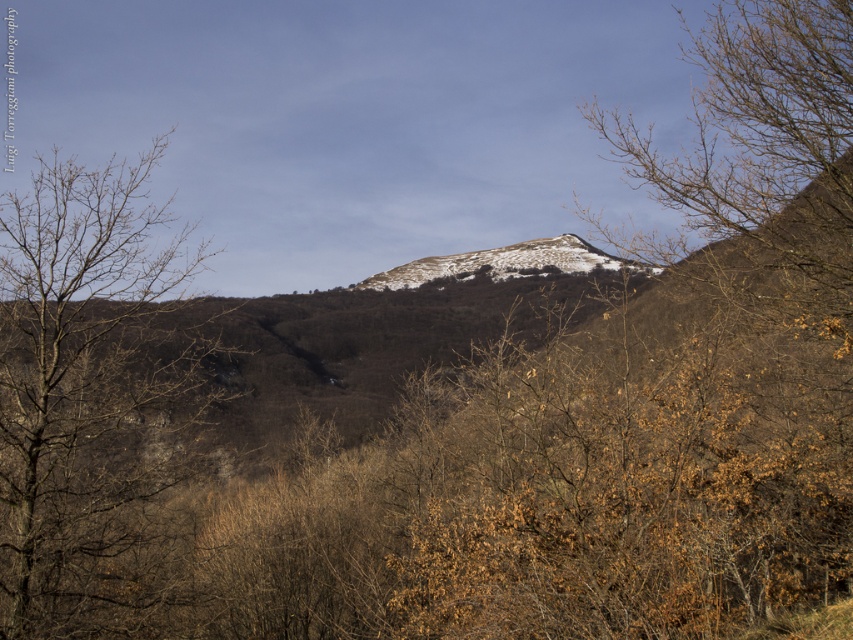
Can you confirm if bare branches at left is positioned above brown leafless branches at upper right?

Actually, bare branches at left is below brown leafless branches at upper right.

Consider the image. Which of these two, bare branches at left or brown leafless branches at upper right, stands shorter?

Standing shorter between the two is bare branches at left.

Is point (94, 477) in front of point (720, 225)?

Yes, it is in front of point (720, 225).

The image size is (853, 640). I want to click on bare branches at left, so click(88, 392).

Which is above, bare branches at left or white powdery snow at center?

bare branches at left

Locate an element on the screen. The height and width of the screenshot is (640, 853). bare branches at left is located at coordinates (88, 392).

Is brown leafless branches at upper right to the right of white powdery snow at center from the viewer's perspective?

Indeed, brown leafless branches at upper right is positioned on the right side of white powdery snow at center.

Which is in front, point (695, 96) or point (518, 272)?

Point (518, 272)

The height and width of the screenshot is (640, 853). In order to click on brown leafless branches at upper right in this screenshot , I will do `click(766, 145)`.